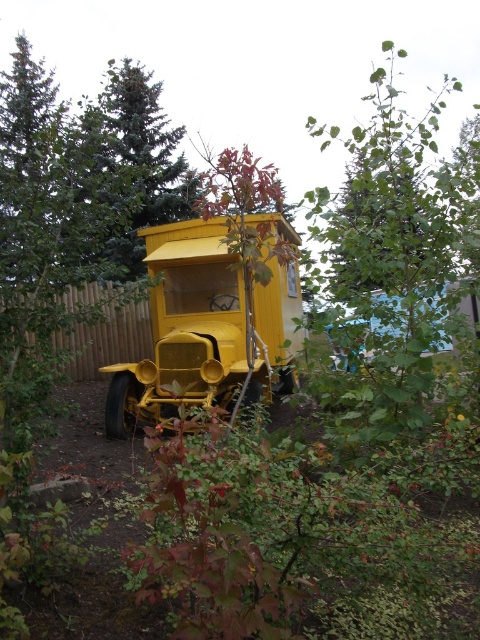
You are standing at the point closest to the wooden fence in the image. Which of the two points, point (435,195) or point (131,141), is closer to the vintage yellow vehicle?

Point (131,141) is closer to the vintage yellow vehicle because it is behind point (435,195), which is in front of it. Since you are at the point near the fence, the closer point would be the one behind, which is point (131,141).

You are standing in the backyard and want to take a photo of the matte yellow car at center without including the green leafy tree at upper center in the frame. Which direction should you move to avoid the tree?

Move to the left side of the matte yellow car at center since the green leafy tree at upper center is positioned to the right of it.